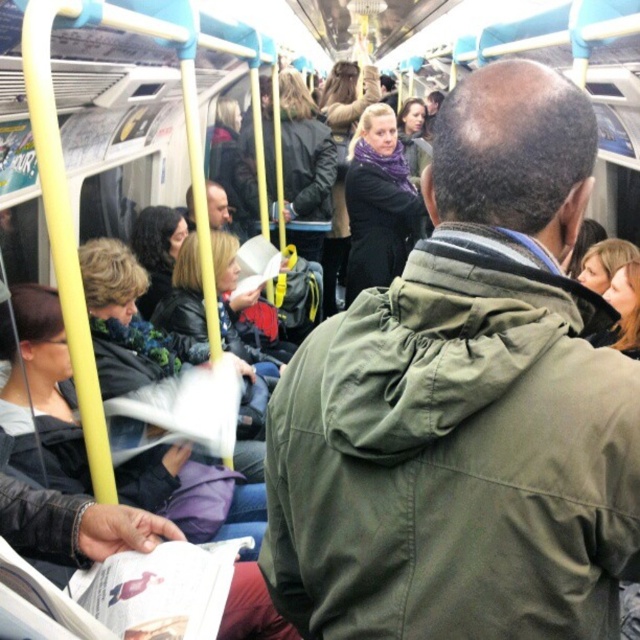
Consider the image. Is green matte jacket at center positioned at the back of matte black jacket at center?

No, green matte jacket at center is closer to the viewer.

Is point (404, 467) more distant than point (193, 209)?

No, (404, 467) is in front of (193, 209).

Where is `green matte jacket at center`? The width and height of the screenshot is (640, 640). green matte jacket at center is located at coordinates (465, 406).